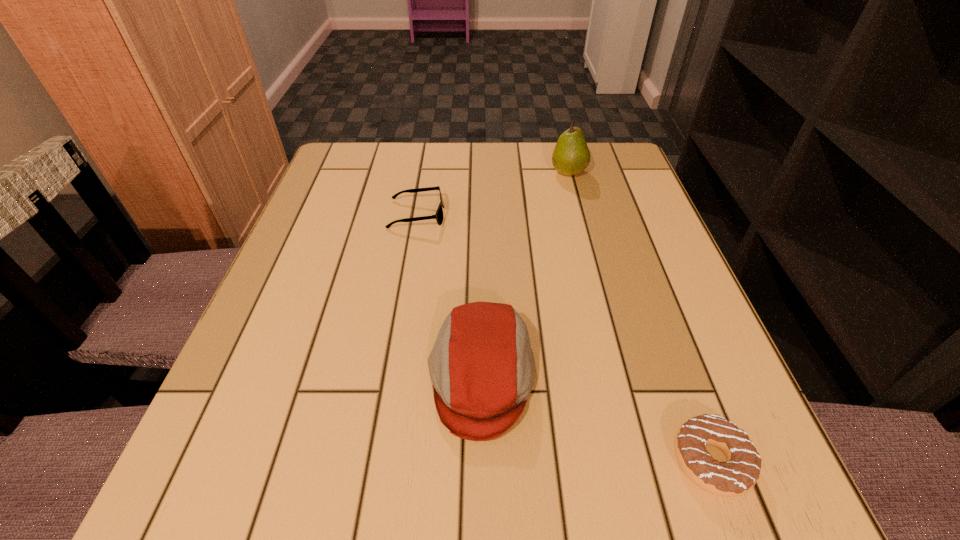
I want to click on vacant point located between the tallest object and the cap, so click(525, 275).

Image resolution: width=960 pixels, height=540 pixels. I want to click on vacant point located between the sunglasses and the cap, so click(449, 296).

The image size is (960, 540). I want to click on vacant area between the doughnut and the sunglasses, so click(564, 338).

Where is `vacant region between the farthest object and the doughnut`? The height and width of the screenshot is (540, 960). vacant region between the farthest object and the doughnut is located at coordinates (639, 316).

The width and height of the screenshot is (960, 540). I want to click on the closest object to the farthest object, so click(438, 216).

This screenshot has width=960, height=540. I want to click on object that is the second closest one to the third shortest object, so click(x=438, y=216).

Where is `blank space that satisfies the following two spatial constraints: 1. on the front-facing side of the second farthest object; 2. on the left side of the doughnut`? The width and height of the screenshot is (960, 540). blank space that satisfies the following two spatial constraints: 1. on the front-facing side of the second farthest object; 2. on the left side of the doughnut is located at coordinates (375, 461).

At what (x,y) coordinates should I click in order to perform the action: click on free region that satisfies the following two spatial constraints: 1. on the front side of the doughnut; 2. on the right side of the farthest object. Please return your answer as a coordinate pair (x, y). This screenshot has height=540, width=960. Looking at the image, I should click on (644, 461).

The height and width of the screenshot is (540, 960). Find the location of `vacant space that satisfies the following two spatial constraints: 1. on the front-facing side of the second tallest object; 2. on the right side of the doughnut`. vacant space that satisfies the following two spatial constraints: 1. on the front-facing side of the second tallest object; 2. on the right side of the doughnut is located at coordinates (481, 461).

You are a GUI agent. You are given a task and a screenshot of the screen. Output one action in this format:
    pyautogui.click(x=<x>, y=<y>)
    Task: Click on the blank area in the image that satisfies the following two spatial constraints: 1. on the front-facing side of the third nearest object; 2. on the right side of the doughnut
    The width and height of the screenshot is (960, 540).
    Given the screenshot: What is the action you would take?
    pyautogui.click(x=375, y=461)